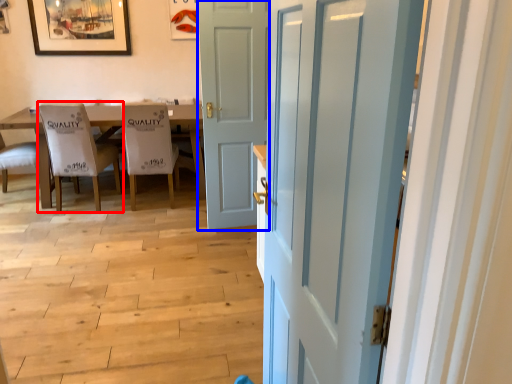
Question: Which object is further to the camera taking this photo, chair (highlighted by a red box) or door (highlighted by a blue box)?

Choices:
 (A) chair
 (B) door

Answer: (A)